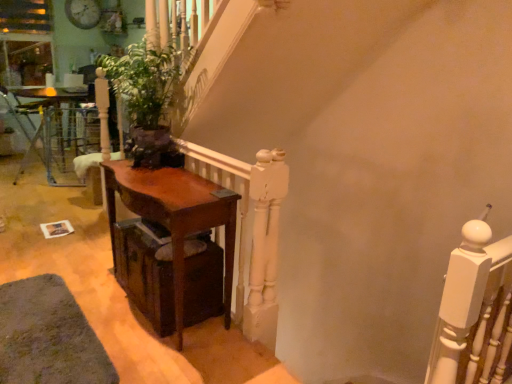
What are the coordinates of `brown wooden table at left, which is counted as the 1th table, starting from the left` in the screenshot? It's located at (55, 132).

How much space does mahogany wood table at center, marked as the first table in a right-to-left arrangement, occupy vertically?

75.99 centimeters.

Identify the location of brown wooden table at left, the second table positioned from the bottom. (55, 132).

Which object is more forward, brown wooden table at left, which is counted as the 1th table, starting from the left, or dark wood drawer at lower left?

dark wood drawer at lower left is closer to the camera.

Considering the positions of points (52, 99) and (119, 276), is point (52, 99) farther from camera compared to point (119, 276)?

Yes, it is behind point (119, 276).

Is brown wooden table at left, the second table viewed from the front, facing towards dark wood drawer at lower left?

No, brown wooden table at left, the second table viewed from the front, does not turn towards dark wood drawer at lower left.

Is brown wooden table at left, the second table viewed from the front, shorter than dark wood drawer at lower left?

Incorrect, the height of brown wooden table at left, the second table viewed from the front, does not fall short of that of dark wood drawer at lower left.

Is mahogany wood table at center, placed as the second table when sorted from left to right, taller or shorter than brown wooden table at left, which is counted as the 1th table, starting from the left?

Considering their sizes, mahogany wood table at center, placed as the second table when sorted from left to right, has less height than brown wooden table at left, which is counted as the 1th table, starting from the left.

Between point (136, 196) and point (15, 90), which one is positioned in front?

The point (136, 196) is closer.

Is mahogany wood table at center, the second table positioned from the top, next to brown wooden table at left, the second table viewed from the front, and touching it?

No.

From a real-world perspective, is mahogany wood table at center, placed as the second table when sorted from left to right, on top of brown wooden table at left, positioned as the 1th table in top-to-bottom order?

Actually, mahogany wood table at center, placed as the second table when sorted from left to right, is physically below brown wooden table at left, positioned as the 1th table in top-to-bottom order, in the real world.

Considering their positions, is white painted wood at upper right located in front of or behind brown wooden table at left, positioned as the 1th table in top-to-bottom order?

Clearly, white painted wood at upper right is in front of brown wooden table at left, positioned as the 1th table in top-to-bottom order.

Who is bigger, white painted wood at upper right or brown wooden table at left, which is counted as the 1th table, starting from the left?

With larger size is brown wooden table at left, which is counted as the 1th table, starting from the left.

Is white painted wood at upper right next to brown wooden table at left, the second table viewed from the front?

No, white painted wood at upper right is not with brown wooden table at left, the second table viewed from the front.

Is point (69, 102) behind point (140, 48)?

Yes, it is.

Between brown wooden table at left, the second table positioned from the bottom, and green matte plant at center, which one has larger width?

brown wooden table at left, the second table positioned from the bottom.

Is brown wooden table at left, the second table viewed from the right, oriented towards green matte plant at center?

No.

Is brown wooden table at left, the second table viewed from the right, at the right side of green matte plant at center?

Incorrect, brown wooden table at left, the second table viewed from the right, is not on the right side of green matte plant at center.

From the picture: Between dark wood drawer at lower left and green matte plant at center, which one has smaller width?

green matte plant at center.

From the image's perspective, between dark wood drawer at lower left and green matte plant at center, who is located below?

dark wood drawer at lower left appears lower in the image.

From a real-world perspective, between dark wood drawer at lower left and green matte plant at center, who is vertically lower?

dark wood drawer at lower left is physically lower.

Measure the distance from white painted wood at upper right to green matte plant at center.

white painted wood at upper right and green matte plant at center are 5.94 feet apart from each other.

Is white painted wood at upper right bigger or smaller than green matte plant at center?

In the image, white painted wood at upper right appears to be smaller than green matte plant at center.

What's the angular difference between white painted wood at upper right and green matte plant at center's facing directions?

The angular difference between white painted wood at upper right and green matte plant at center is 70 degrees.

From the image's perspective, is white painted wood at upper right on top of green matte plant at center?

No, from the image's perspective, white painted wood at upper right is not above green matte plant at center.

From a real-world perspective, is white painted wood at upper right physically below dark wood drawer at lower left?

Incorrect, from a real-world perspective, white painted wood at upper right is higher than dark wood drawer at lower left.

Where is `rail in front of the dark wood drawer at lower left`? The height and width of the screenshot is (384, 512). rail in front of the dark wood drawer at lower left is located at coordinates (474, 311).

Is dark wood drawer at lower left located within white painted wood at upper right?

That's incorrect, dark wood drawer at lower left is not inside white painted wood at upper right.

Is white painted wood at upper right oriented away from dark wood drawer at lower left?

No, white painted wood at upper right is not facing away from dark wood drawer at lower left.

Where is `drawer that is below the brown wooden table at left, which is counted as the 1th table, starting from the left (from the image's perspective)`? The image size is (512, 384). drawer that is below the brown wooden table at left, which is counted as the 1th table, starting from the left (from the image's perspective) is located at coordinates (146, 272).

Identify the location of table that is on the right side of brown wooden table at left, which ranks as the 1th table in back-to-front order. (175, 216).

Based on their spatial positions, is white painted wood at upper right or mahogany wood table at center, the 1th table from the front, further from brown wooden table at left, the second table positioned from the bottom?

white painted wood at upper right is positioned further to the anchor brown wooden table at left, the second table positioned from the bottom.

Which object lies further to the anchor point dark wood drawer at lower left, brown wooden table at left, which is counted as the 1th table, starting from the left, or mahogany wood table at center, which is the first table from bottom to top?

brown wooden table at left, which is counted as the 1th table, starting from the left, is positioned further to the anchor dark wood drawer at lower left.

When comparing their distances from green matte plant at center, does white painted wood at upper right or brown wooden table at left, the second table viewed from the front, seem further?

Among the two, brown wooden table at left, the second table viewed from the front, is located further to green matte plant at center.

Which object lies nearer to the anchor point brown wooden table at left, which is counted as the 1th table, starting from the left, mahogany wood table at center, the 1th table from the front, or dark wood drawer at lower left?

The object closer to brown wooden table at left, which is counted as the 1th table, starting from the left, is mahogany wood table at center, the 1th table from the front.

Considering their positions, is mahogany wood table at center, placed as the second table when sorted from left to right, positioned closer to dark wood drawer at lower left than brown wooden table at left, the second table viewed from the front?

The object closer to dark wood drawer at lower left is mahogany wood table at center, placed as the second table when sorted from left to right.

Considering their positions, is mahogany wood table at center, which is the first table from bottom to top, positioned closer to white painted wood at upper right than brown wooden table at left, which ranks as the 1th table in back-to-front order?

Based on the image, mahogany wood table at center, which is the first table from bottom to top, appears to be nearer to white painted wood at upper right.

Looking at this image, considering their positions, is green matte plant at center positioned further to dark wood drawer at lower left than brown wooden table at left, the second table viewed from the front?

brown wooden table at left, the second table viewed from the front, lies further to dark wood drawer at lower left than the other object.

From the image, which object appears to be farther from white painted wood at upper right, green matte plant at center or mahogany wood table at center, which is the first table from bottom to top?

The object further to white painted wood at upper right is green matte plant at center.

Locate an element on the screen. The image size is (512, 384). table between green matte plant at center and dark wood drawer at lower left vertically is located at coordinates (175, 216).

Image resolution: width=512 pixels, height=384 pixels. Find the location of `table between green matte plant at center and white painted wood at upper right from left to right`. table between green matte plant at center and white painted wood at upper right from left to right is located at coordinates (175, 216).

You are a GUI agent. You are given a task and a screenshot of the screen. Output one action in this format:
    pyautogui.click(x=<x>, y=<y>)
    Task: Click on the drawer between mahogany wood table at center, placed as the second table when sorted from left to right, and white painted wood at upper right, in the horizontal direction
    The width and height of the screenshot is (512, 384).
    Given the screenshot: What is the action you would take?
    pyautogui.click(x=146, y=272)

Find the location of `houseplant between mahogany wood table at center, the second table from the back, and brown wooden table at left, which ranks as the 1th table in back-to-front order, in the front-back direction`. houseplant between mahogany wood table at center, the second table from the back, and brown wooden table at left, which ranks as the 1th table in back-to-front order, in the front-back direction is located at coordinates (146, 102).